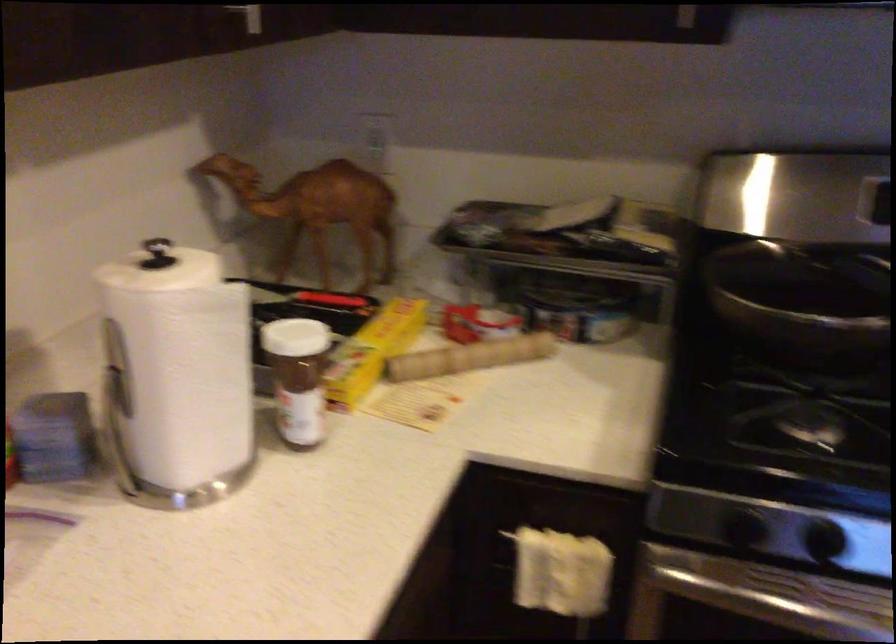
Image resolution: width=896 pixels, height=644 pixels. I want to click on oven door handle, so click(756, 596).